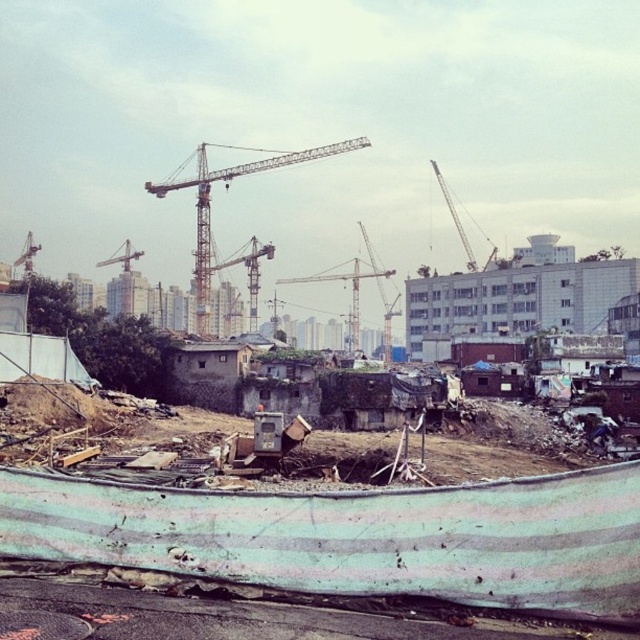
Between point (355, 284) and point (125, 301), which one is positioned behind?

Point (355, 284)

Which is more to the left, yellow metallic crane at center or metallic yellow crane at upper center?

Positioned to the left is metallic yellow crane at upper center.

Locate an element on the screen. Image resolution: width=640 pixels, height=640 pixels. yellow metallic crane at center is located at coordinates (352, 285).

This screenshot has height=640, width=640. Describe the element at coordinates (227, 188) in the screenshot. I see `metallic yellow crane at center` at that location.

Who is more distant from viewer, (208, 252) or (445, 200)?

Positioned behind is point (445, 200).

Is point (205, 326) farther from viewer compared to point (468, 250)?

No, it is not.

Locate an element on the screen. metallic yellow crane at center is located at coordinates (227, 188).

Which is in front, point (257, 257) or point (470, 264)?

Point (257, 257) is more forward.

Which is below, metallic gray crane at center or metallic gray crane at upper right?

metallic gray crane at center

Describe the element at coordinates (250, 273) in the screenshot. I see `metallic gray crane at center` at that location.

In order to click on metallic gray crane at center in this screenshot , I will do `click(250, 273)`.